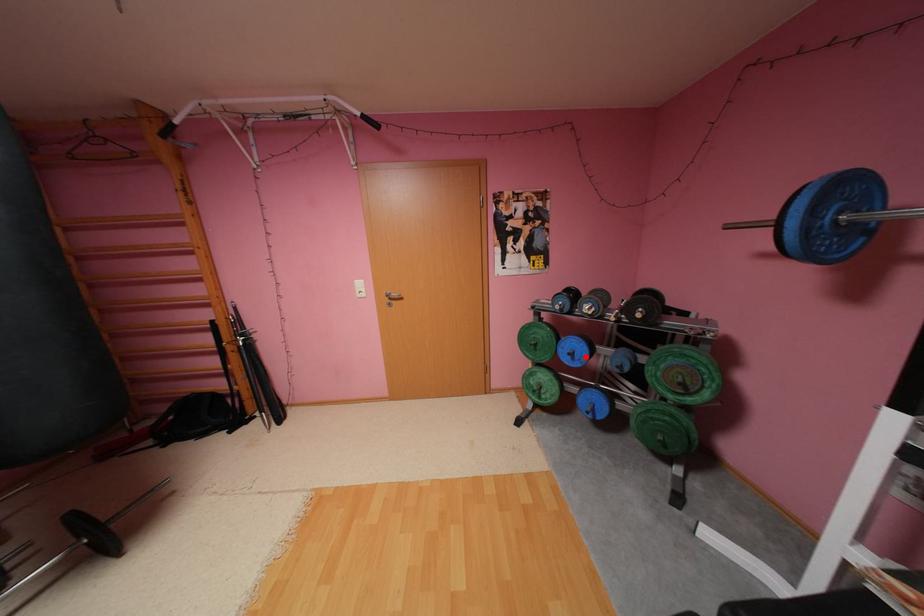
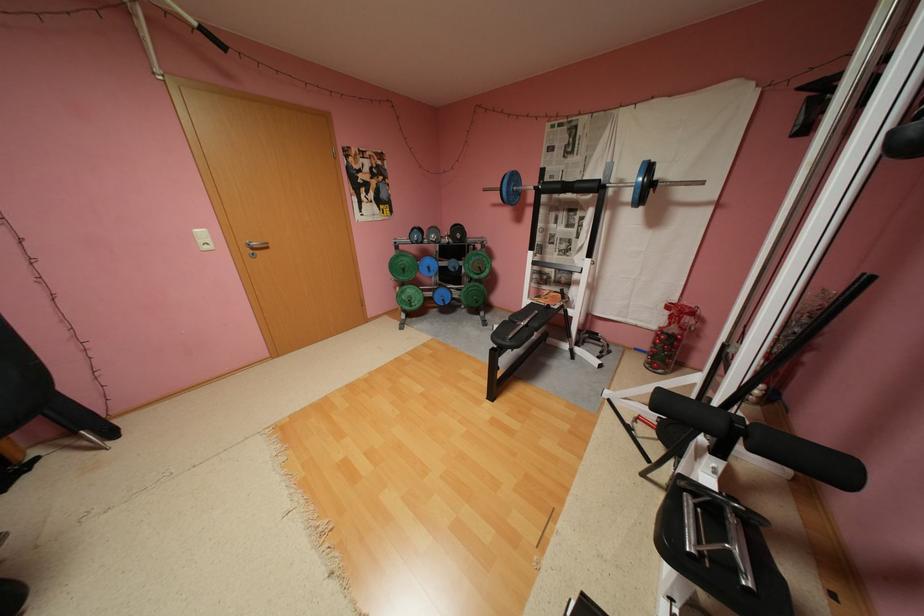
Question: A red point is marked in image1. In image2, is the corresponding 3D point closer to the camera or farther? Reply with the corresponding letter.

Choices:
 (A) The corresponding 3D point is closer.
 (B) The corresponding 3D point is farther.

Answer: (A)